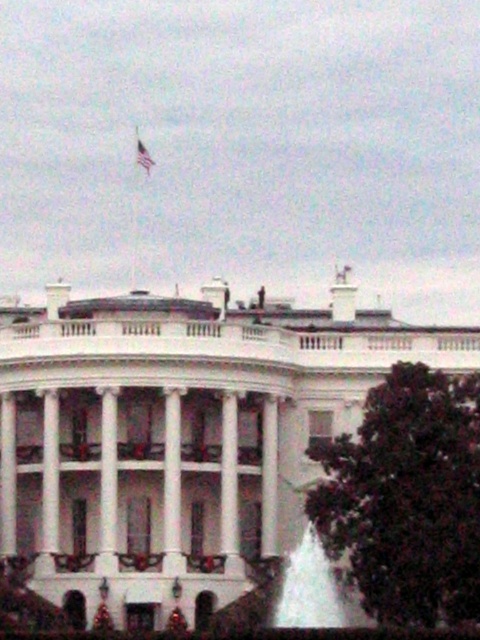
You are standing at the entrance of the White House and want to locate the white glossy fountain at lower center. According to the coordinates provided, in which direction should you move relative to your current position?

The white glossy fountain at lower center is located at coordinates point (x=314, y=589). Since the coordinates are in the lower center area, you should move forward and slightly to the right from the entrance to reach it.

You are a photographer planning to take a photo of the White House. You want to ensure both the white glossy fountain at lower center and the silky fabric flag at upper center are clearly visible. Which object should you focus on first to ensure proper framing, considering their sizes?

The white glossy fountain at lower center is larger in size than the silky fabric flag at upper center, so you should focus on the white glossy fountain at lower center first to ensure proper framing.

In the scene shown: You are standing in front of the White House and notice two points marked on the building. The first point is at coordinates point(275, 614) and the second is at point(148, 156). Which point is closer to your current position?

Point(275, 614) is closer to the camera than point(148, 156), so the first point is closer to your current position.